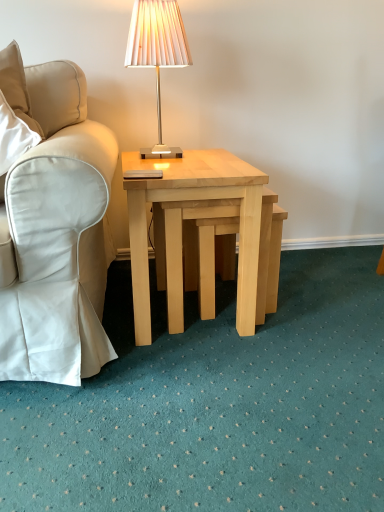
Question: From a real-world perspective, is matte beige lamp at upper center physically located above or below white fabric chair at left?

Choices:
 (A) below
 (B) above

Answer: (B)

Question: Is matte beige lamp at upper center taller or shorter than white fabric chair at left?

Choices:
 (A) tall
 (B) short

Answer: (B)

Question: Estimate the real-world distances between objects in this image. Which object is farther from the white fabric chair at left?

Choices:
 (A) matte beige lamp at upper center
 (B) natural wood stool at center
 (C) light wood/natural wood coffee table at center

Answer: (A)

Question: Which is farther from the matte beige lamp at upper center?

Choices:
 (A) light wood/natural wood coffee table at center
 (B) white fabric chair at left
 (C) natural wood stool at center

Answer: (C)